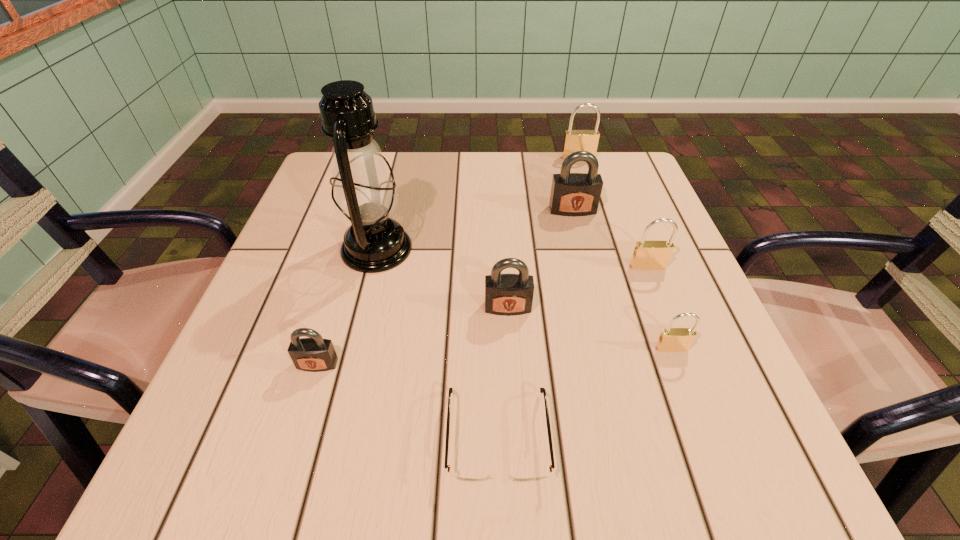
At what (x,y) coordinates should I click in order to perform the action: click on free space at the far left corner of the desktop. Please return your answer as a coordinate pair (x, y). Looking at the image, I should click on (319, 196).

You are a GUI agent. You are given a task and a screenshot of the screen. Output one action in this format:
    pyautogui.click(x=<x>, y=<y>)
    Task: Click on the free point at the near left corner
    This screenshot has height=540, width=960.
    Given the screenshot: What is the action you would take?
    pyautogui.click(x=187, y=475)

In the image, there is a desktop. Where is `free space at the far right corner`? This screenshot has height=540, width=960. free space at the far right corner is located at coordinates pyautogui.click(x=602, y=155).

Find the location of a particular element. Image resolution: width=960 pixels, height=540 pixels. free spot between the second smallest gray padlock and the nearest brass padlock is located at coordinates (589, 328).

This screenshot has height=540, width=960. In order to click on unoccupied position between the smallest gray padlock and the farthest object in this screenshot , I will do [447, 261].

The height and width of the screenshot is (540, 960). I want to click on free space between the farthest padlock and the second biggest gray padlock, so click(543, 233).

Where is `vacant area that lies between the spectacles and the farthest padlock`? The image size is (960, 540). vacant area that lies between the spectacles and the farthest padlock is located at coordinates (538, 297).

Where is `vacant region between the black oil lamp and the second farthest brass padlock`? The width and height of the screenshot is (960, 540). vacant region between the black oil lamp and the second farthest brass padlock is located at coordinates (513, 258).

The width and height of the screenshot is (960, 540). Identify the location of free space between the second farthest padlock and the nearest object. (535, 323).

At what (x,y) coordinates should I click in order to perform the action: click on vacant region between the smallest brass padlock and the farthest gray padlock. Please return your answer as a coordinate pair (x, y). The image size is (960, 540). Looking at the image, I should click on (622, 279).